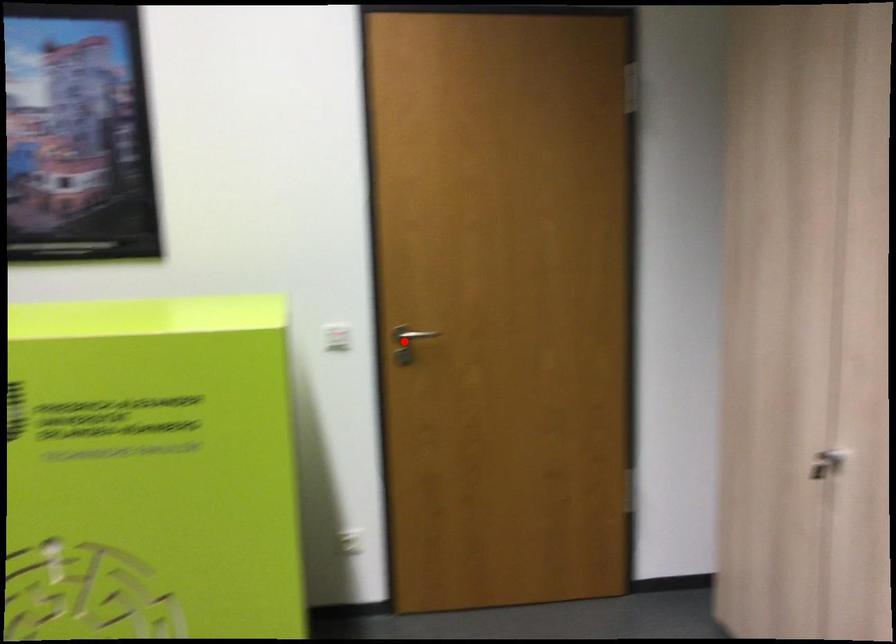
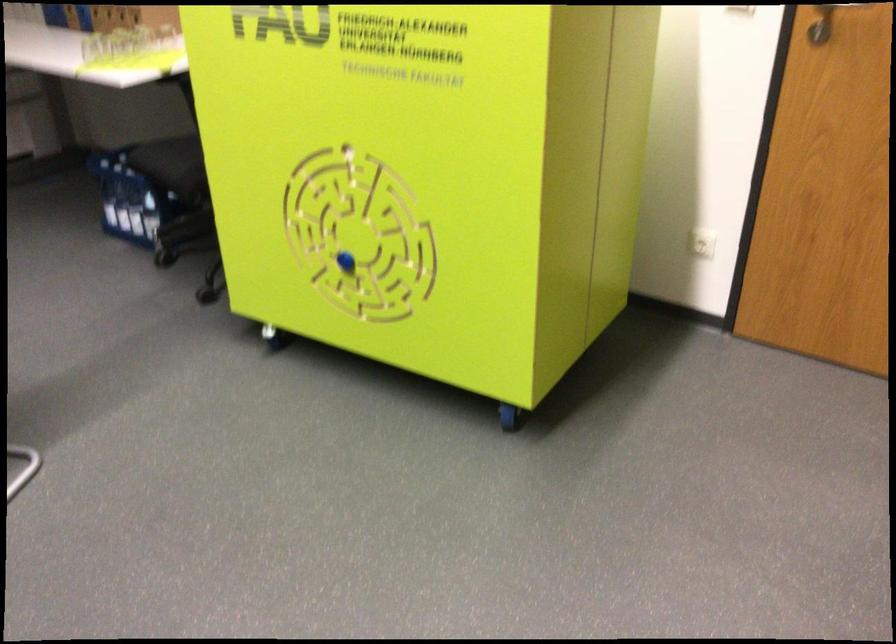
In the second image, find the point that corresponds to the highlighted location in the first image.

(821, 24)